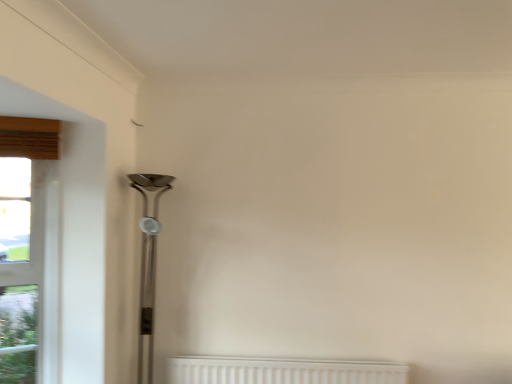
Question: Is clear glass window at left taller or shorter than polished silver table lamp at left?

Choices:
 (A) tall
 (B) short

Answer: (B)

Question: From the image's perspective, is clear glass window at left above or below polished silver table lamp at left?

Choices:
 (A) above
 (B) below

Answer: (B)

Question: Is point click(x=5, y=329) positioned closer to the camera than point click(x=141, y=319)?

Choices:
 (A) closer
 (B) farther

Answer: (A)

Question: Does point (150, 284) appear closer or farther from the camera than point (50, 135)?

Choices:
 (A) closer
 (B) farther

Answer: (B)

Question: Considering the relative positions of polished silver table lamp at left and clear glass window at left in the image provided, is polished silver table lamp at left to the left or to the right of clear glass window at left?

Choices:
 (A) right
 (B) left

Answer: (A)

Question: Is polished silver table lamp at left bigger or smaller than clear glass window at left?

Choices:
 (A) big
 (B) small

Answer: (A)

Question: From the image's perspective, is polished silver table lamp at left located above or below clear glass window at left?

Choices:
 (A) above
 (B) below

Answer: (A)